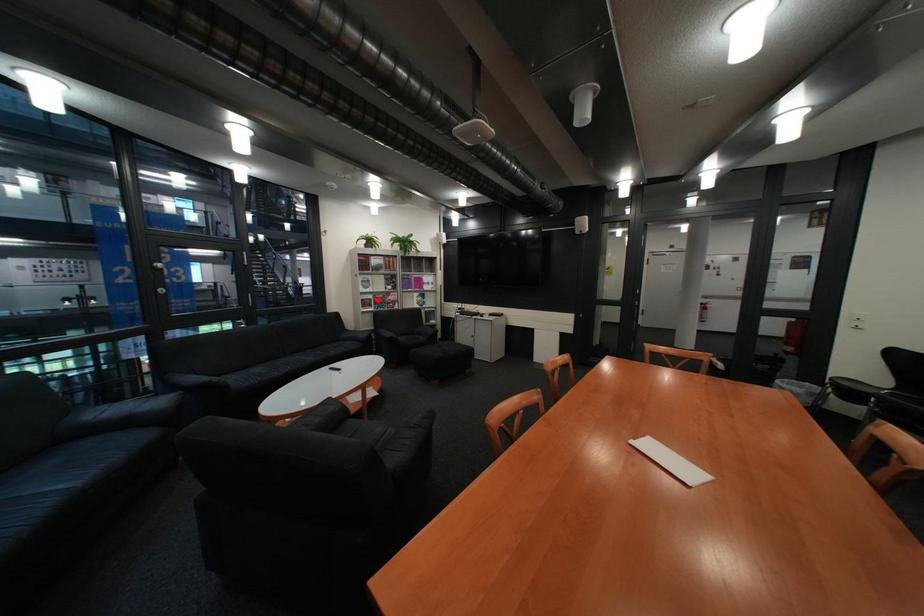
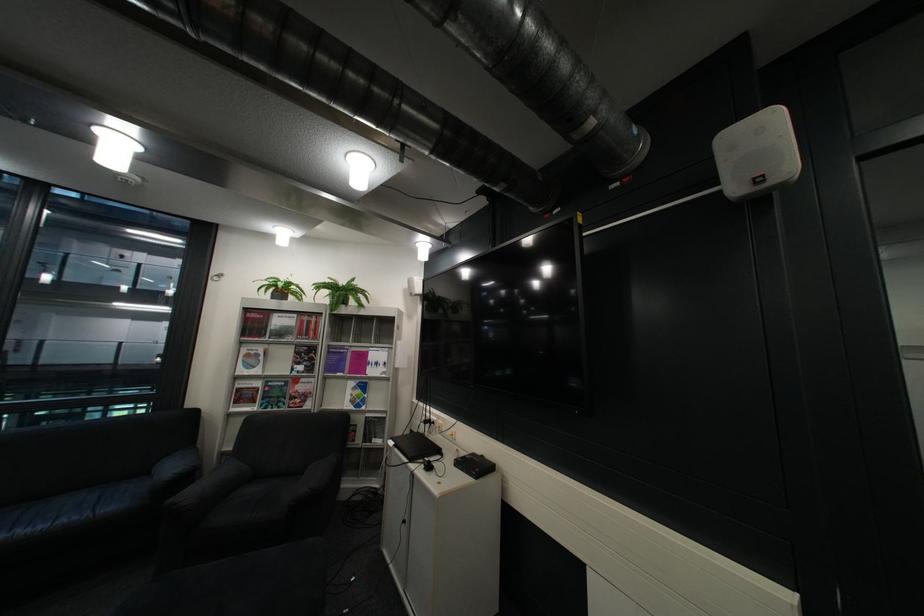
Question: A red point is marked in image1. In image2, is the corresponding 3D point closer to the camera or farther? Reply with the corresponding letter.

Choices:
 (A) The corresponding 3D point is closer.
 (B) The corresponding 3D point is farther.

Answer: (B)